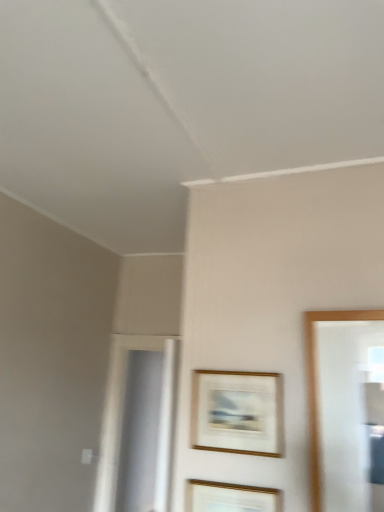
Question: Would you say gold-framed picture at center, acting as the 2th picture frame starting from the top, is to the left or to the right of gold-framed artwork at center, which is the 1th picture frame from top to bottom, in the picture?

Choices:
 (A) left
 (B) right

Answer: (A)

Question: From a real-world perspective, is gold-framed picture at center, which ranks as the 1th picture frame in bottom-to-top order, above or below gold-framed artwork at center, which appears as the 2th picture frame when ordered from the bottom?

Choices:
 (A) below
 (B) above

Answer: (A)

Question: Which is correct: gold-framed picture at center, which ranks as the 1th picture frame in bottom-to-top order, is inside gold-framed artwork at center, which appears as the 2th picture frame when ordered from the bottom, or outside of it?

Choices:
 (A) inside
 (B) outside

Answer: (B)

Question: Considering the relative positions of gold-framed artwork at center, which appears as the 2th picture frame when ordered from the bottom, and gold-framed picture at center, acting as the 2th picture frame starting from the top, in the image provided, is gold-framed artwork at center, which appears as the 2th picture frame when ordered from the bottom, to the left or to the right of gold-framed picture at center, acting as the 2th picture frame starting from the top,?

Choices:
 (A) left
 (B) right

Answer: (B)

Question: Is gold-framed artwork at center, which appears as the 2th picture frame when ordered from the bottom, wider or thinner than gold-framed picture at center, acting as the 2th picture frame starting from the top?

Choices:
 (A) wide
 (B) thin

Answer: (B)

Question: Considering the positions of gold-framed artwork at center, which is the 1th picture frame from top to bottom, and gold-framed picture at center, which ranks as the 1th picture frame in bottom-to-top order, in the image, is gold-framed artwork at center, which is the 1th picture frame from top to bottom, taller or shorter than gold-framed picture at center, which ranks as the 1th picture frame in bottom-to-top order,?

Choices:
 (A) tall
 (B) short

Answer: (B)

Question: Considering their positions, is gold-framed artwork at center, which appears as the 2th picture frame when ordered from the bottom, located in front of or behind gold-framed picture at center, acting as the 2th picture frame starting from the top?

Choices:
 (A) front
 (B) behind

Answer: (B)